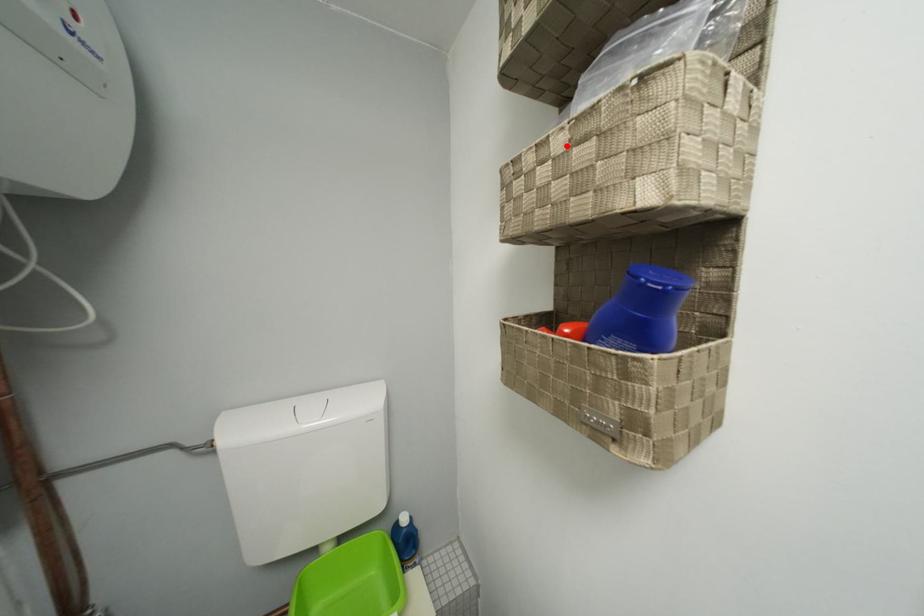
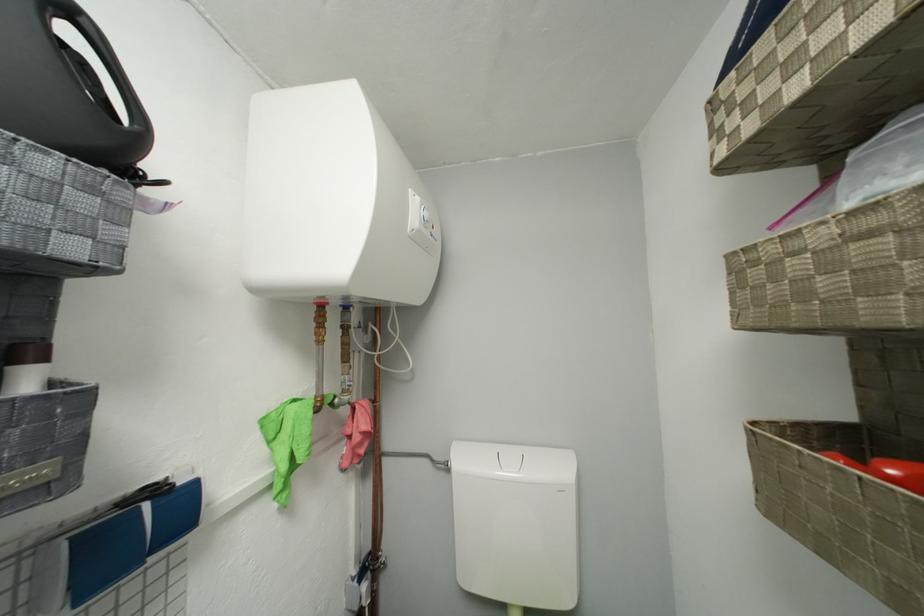
The point at the highlighted location is marked in the first image. Where is the corresponding point in the second image?

(829, 238)